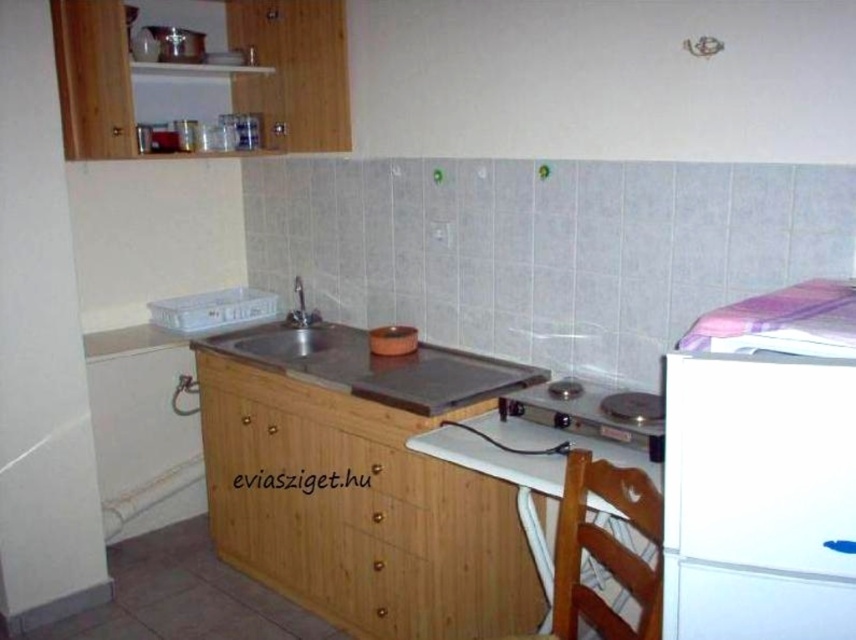
Question: Does wooden chair at lower right have a greater width compared to metallic gray stove at center?

Choices:
 (A) yes
 (B) no

Answer: (B)

Question: Which object is farther from the camera taking this photo?

Choices:
 (A) metallic gray stove at center
 (B) white matte refrigerator at right
 (C) metallic sink at center

Answer: (C)

Question: Which point is closer to the camera taking this photo?

Choices:
 (A) (364, 339)
 (B) (661, 417)
 (C) (724, 545)

Answer: (C)

Question: Is white matte refrigerator at right to the right of wooden chair at lower right from the viewer's perspective?

Choices:
 (A) no
 (B) yes

Answer: (B)

Question: Which point is closer to the camera?

Choices:
 (A) wooden chair at lower right
 (B) metallic sink at center

Answer: (A)

Question: Does wooden chair at lower right appear over metallic sink at center?

Choices:
 (A) yes
 (B) no

Answer: (B)